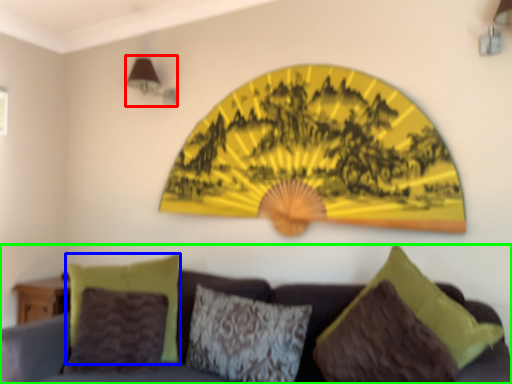
Question: Which is farther away from lamp (highlighted by a red box)? pillow (highlighted by a blue box) or studio couch (highlighted by a green box)?

Choices:
 (A) pillow
 (B) studio couch

Answer: (B)